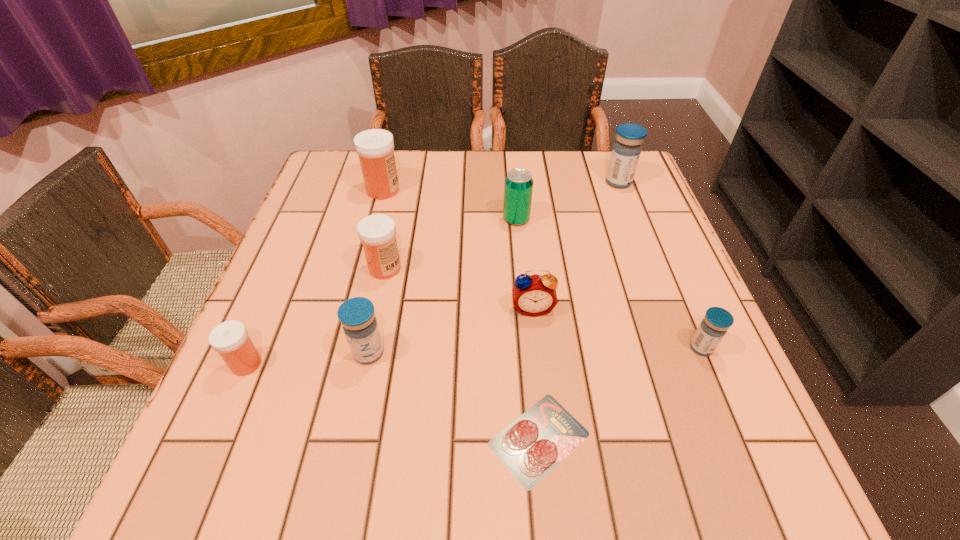
Locate an element on the screen. vacant space at the far left corner of the desktop is located at coordinates (341, 150).

Image resolution: width=960 pixels, height=540 pixels. I want to click on vacant region at the near right corner of the desktop, so 790,500.

Where is `free space that is in between the teal beer can and the nearest object`? Image resolution: width=960 pixels, height=540 pixels. free space that is in between the teal beer can and the nearest object is located at coordinates (528, 329).

The image size is (960, 540). I want to click on free space between the leftmost blue medicine and the biggest blue medicine, so click(493, 267).

The width and height of the screenshot is (960, 540). Identify the location of vacant area that lies between the teal beer can and the biggest white medicine. (449, 205).

You are a GUI agent. You are given a task and a screenshot of the screen. Output one action in this format:
    pyautogui.click(x=<x>, y=<y>)
    Task: Click on the empty space between the beer can and the leftmost object
    The height and width of the screenshot is (540, 960).
    Given the screenshot: What is the action you would take?
    pyautogui.click(x=381, y=292)

The image size is (960, 540). I want to click on free spot between the second smallest white medicine and the farthest blue medicine, so click(x=502, y=225).

Where is `free spot between the smallest blue medicine and the biggest white medicine`? This screenshot has height=540, width=960. free spot between the smallest blue medicine and the biggest white medicine is located at coordinates (542, 269).

Where is `empty space between the fourth farthest object and the salami`? The image size is (960, 540). empty space between the fourth farthest object and the salami is located at coordinates [462, 354].

Locate an element on the screen. empty location between the fifth farthest object and the biggest blue medicine is located at coordinates tap(575, 245).